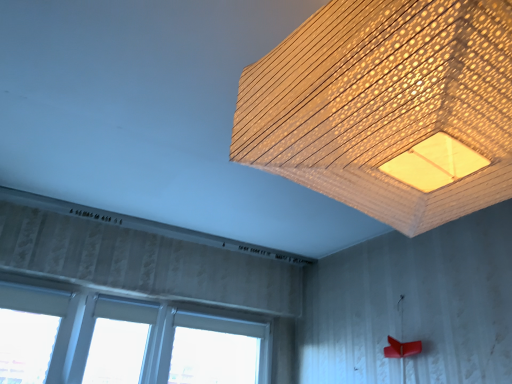
Question: Is white plastic window at lower left further to the viewer compared to wooden textured lampshade at upper center?

Choices:
 (A) no
 (B) yes

Answer: (B)

Question: From the image's perspective, is white plastic window at lower left on wooden textured lampshade at upper center?

Choices:
 (A) yes
 (B) no

Answer: (B)

Question: Is white plastic window at lower left smaller than wooden textured lampshade at upper center?

Choices:
 (A) yes
 (B) no

Answer: (A)

Question: From a real-world perspective, does white plastic window at lower left sit lower than wooden textured lampshade at upper center?

Choices:
 (A) no
 (B) yes

Answer: (B)

Question: Is white plastic window at lower left closer to camera compared to wooden textured lampshade at upper center?

Choices:
 (A) yes
 (B) no

Answer: (B)

Question: From the image's perspective, is white plastic window at lower left under wooden textured lampshade at upper center?

Choices:
 (A) yes
 (B) no

Answer: (A)

Question: From the image's perspective, is wooden textured lampshade at upper center on white plastic window at lower left?

Choices:
 (A) no
 (B) yes

Answer: (B)

Question: Does wooden textured lampshade at upper center have a lesser width compared to white plastic window at lower left?

Choices:
 (A) yes
 (B) no

Answer: (B)

Question: From a real-world perspective, is wooden textured lampshade at upper center positioned over white plastic window at lower left based on gravity?

Choices:
 (A) no
 (B) yes

Answer: (B)

Question: Can you confirm if wooden textured lampshade at upper center is positioned to the left of white plastic window at lower left?

Choices:
 (A) yes
 (B) no

Answer: (B)

Question: Considering the relative sizes of wooden textured lampshade at upper center and white plastic window at lower left in the image provided, is wooden textured lampshade at upper center wider than white plastic window at lower left?

Choices:
 (A) no
 (B) yes

Answer: (B)

Question: Would you say wooden textured lampshade at upper center is outside white plastic window at lower left?

Choices:
 (A) yes
 (B) no

Answer: (A)

Question: Is point (452, 8) closer or farther from the camera than point (115, 382)?

Choices:
 (A) closer
 (B) farther

Answer: (A)